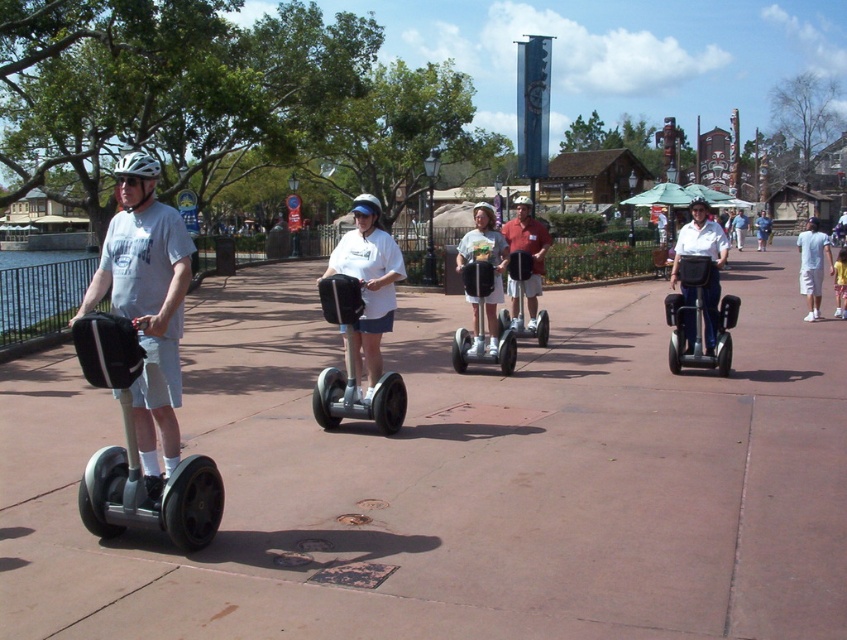
Question: Does matte gray helmet at left have a smaller size compared to yellow matte shirt at center?

Choices:
 (A) no
 (B) yes

Answer: (B)

Question: Is brown concrete pavement at center positioned in front of denim shorts at center?

Choices:
 (A) no
 (B) yes

Answer: (B)

Question: Which point is farther to the camera?

Choices:
 (A) (706, 253)
 (B) (524, 218)

Answer: (B)

Question: Which of these objects is positioned farthest from the matte white helmet at center?

Choices:
 (A) matte red shirt at center
 (B) yellow matte shirt at center
 (C) white cotton shirt at center

Answer: (B)

Question: Among these points, which one is nearest to the camera?

Choices:
 (A) (662, 323)
 (B) (486, 324)
 (C) (458, 332)

Answer: (C)

Question: Is silver metallic segway at left positioned in front of white shirt at center?

Choices:
 (A) yes
 (B) no

Answer: (A)